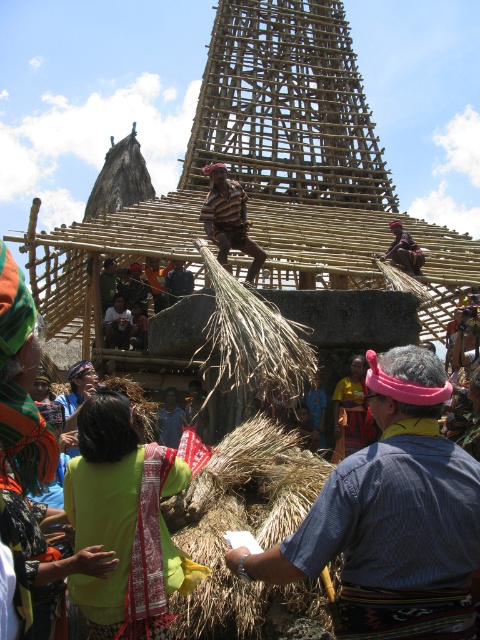
You are a photographer at the event and want to capture both the bamboo structure at center and the dark blue shirt at center in a single frame. Since the camera has a limited depth of field, which object should you focus on to ensure it appears sharp, considering their sizes?

The bamboo structure at center is bigger than the dark blue shirt at center, so focusing on the bamboo structure at center would ensure it appears sharp in the photo.